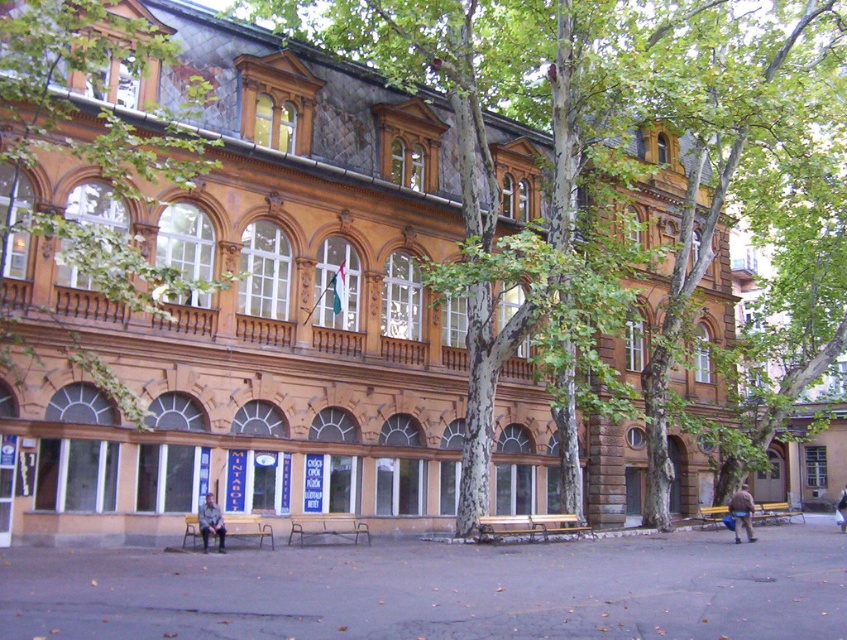
Question: Which of the following is the farthest from the observer?

Choices:
 (A) metallic silver bench at center
 (B) brown fuzzy coat at lower right

Answer: (B)

Question: In this image, where is green textured tree at center located relative to white cotton shirt at center?

Choices:
 (A) left
 (B) right

Answer: (A)

Question: Is green leafy tree at center to the right of wooden park bench at lower left from the viewer's perspective?

Choices:
 (A) no
 (B) yes

Answer: (A)

Question: Which point appears closest to the camera in this image?

Choices:
 (A) (746, 497)
 (B) (242, 531)

Answer: (B)

Question: Can you confirm if green textured tree at center is wider than white cotton shirt at center?

Choices:
 (A) yes
 (B) no

Answer: (A)

Question: Which point appears farthest from the camera in this image?

Choices:
 (A) (573, 518)
 (B) (800, 515)
 (C) (491, 339)
 (D) (839, 504)

Answer: (B)